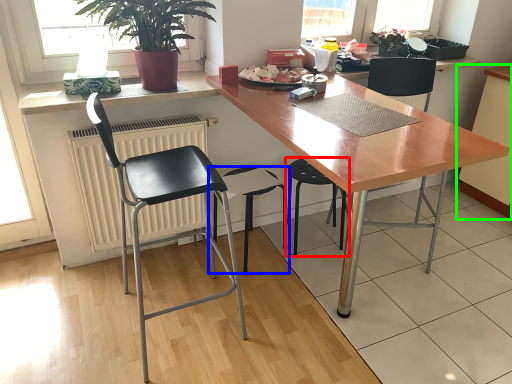
Question: Estimate the real-world distances between objects in this image. Which object is farther from chair (highlighted by a red box), chair (highlighted by a blue box) or cabinetry (highlighted by a green box)?

Choices:
 (A) chair
 (B) cabinetry

Answer: (B)